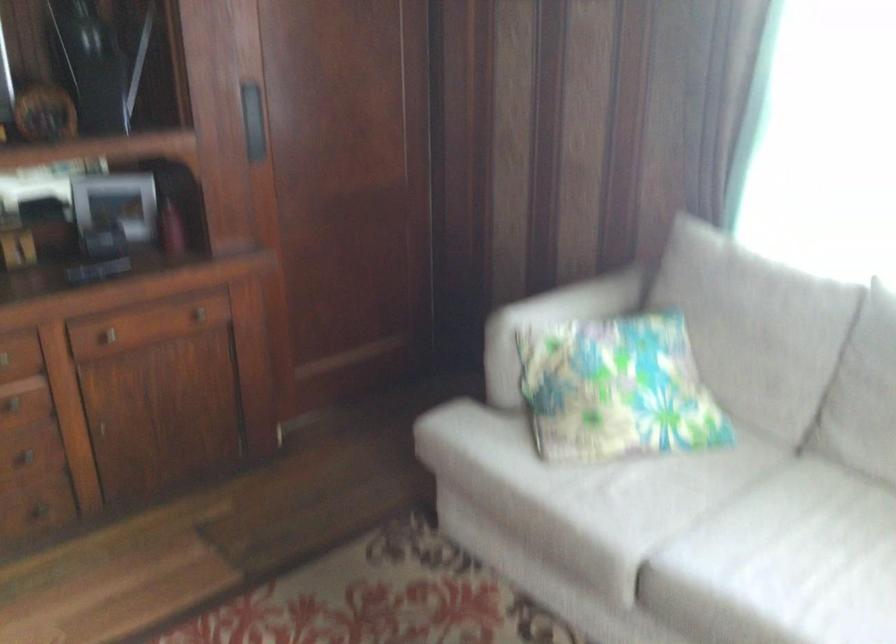
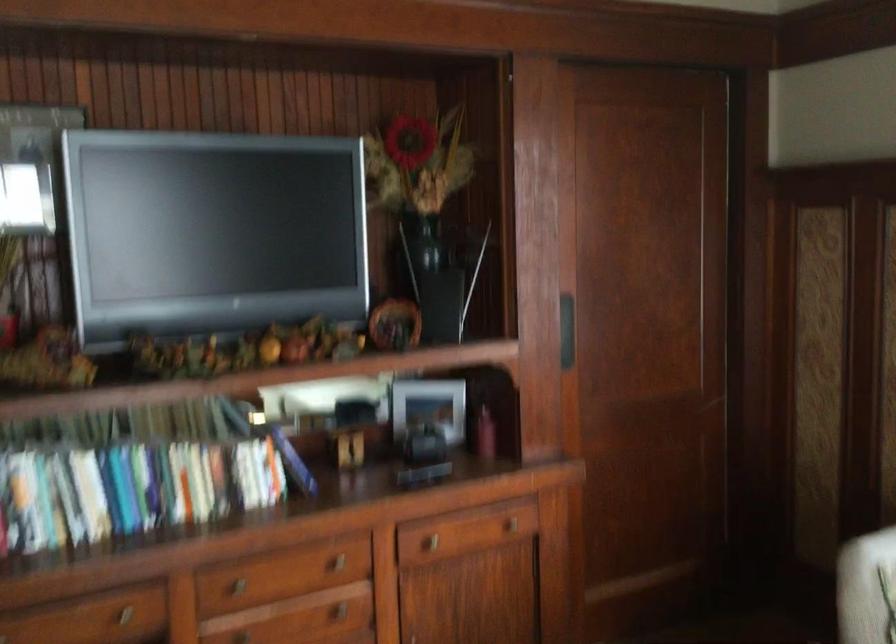
Where in the second image is the point corresponding to (x=115, y=200) from the first image?

(428, 406)